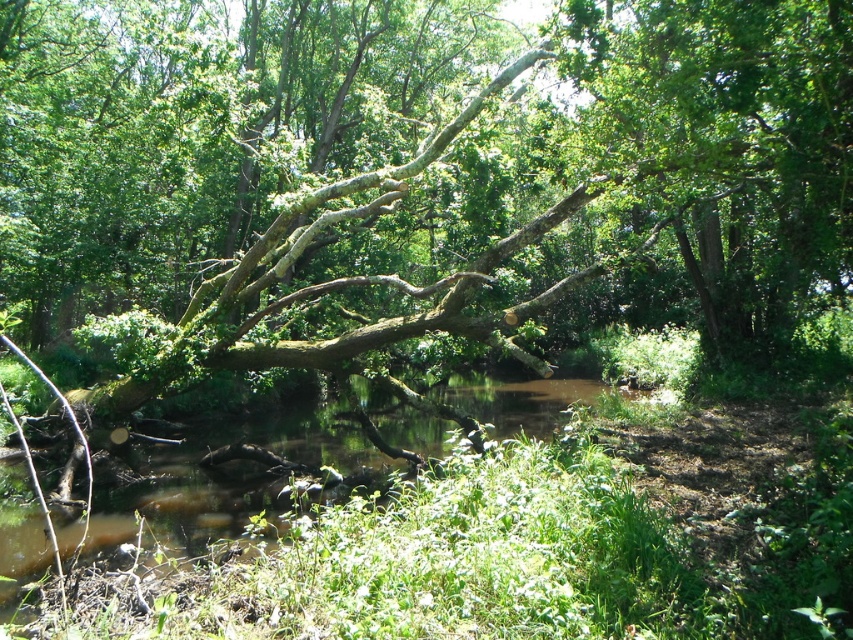
You are a hiker trying to cross the water body in the scene. You see the green mossy branch at center and the brown muddy water at center. Which object is closer to you, and would stepping on the branch help you avoid the muddy water?

The green mossy branch at center is closer to you than the brown muddy water at center. Stepping on the branch could help you avoid the muddy water since it is positioned in front of the water.

You are a hiker trying to cross the brown muddy water at center. There is a green leafy tree at upper right. Which direction should you look for a possible path to avoid the water?

The green leafy tree at upper right is located to the right of brown muddy water at center. Therefore, you should look towards the right side of the brown muddy water at center to find a possible path to avoid the water.

You are a hiker trying to cross the fallen tree trunk. You notice the green mossy branch at center and the green leafy tree at upper right. Which object is taller?

The green mossy branch at center is taller than the green leafy tree at upper right.